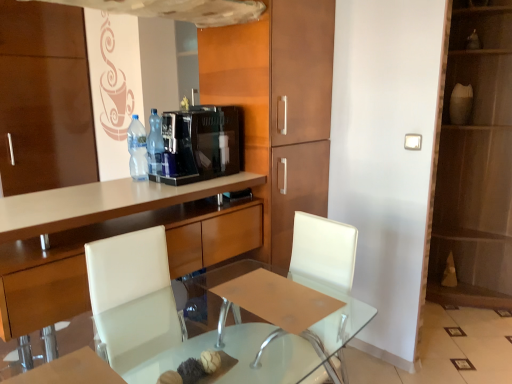
The height and width of the screenshot is (384, 512). What do you see at coordinates (111, 236) in the screenshot? I see `wooden cabinet at center, which appears as the second cabinetry when viewed from the right` at bounding box center [111, 236].

The image size is (512, 384). I want to click on translucent plastic bottle at center, which is the first bottle from right to left, so click(x=155, y=146).

Find the location of a particular element. The width and height of the screenshot is (512, 384). black glossy coffee machine at center is located at coordinates (200, 144).

Measure the distance between point (170, 338) and camera.

Point (170, 338) and camera are 5.65 feet apart from each other.

Identify the location of wooden cabinet at center, which ranks as the 1th cabinetry in right-to-left order. This screenshot has height=384, width=512. (278, 106).

Which object is positioned more to the right, matte brown dresser at right or white leather armchair at center?

matte brown dresser at right is more to the right.

Based on the photo, from the image's perspective, does matte brown dresser at right appear higher than white leather armchair at center?

Yes.

Could you tell me if matte brown dresser at right is turned towards white leather armchair at center?

No, matte brown dresser at right does not turn towards white leather armchair at center.

Based on the photo, is white leather armchair at center next to wooden cabinet at center, the 2th cabinetry when ordered from left to right, and touching it?

white leather armchair at center and wooden cabinet at center, the 2th cabinetry when ordered from left to right, are not in contact.

Looking at this image, from the image's perspective, is white leather armchair at center positioned above or below wooden cabinet at center, the 2th cabinetry when ordered from left to right?

From the image's perspective, white leather armchair at center appears below wooden cabinet at center, the 2th cabinetry when ordered from left to right.

The width and height of the screenshot is (512, 384). Find the location of `armchair located underneath the wooden cabinet at center, the 2th cabinetry when ordered from left to right (from a real-world perspective)`. armchair located underneath the wooden cabinet at center, the 2th cabinetry when ordered from left to right (from a real-world perspective) is located at coordinates (133, 297).

Is white leather armchair at center aimed at wooden cabinet at center, which ranks as the 1th cabinetry in right-to-left order?

No, white leather armchair at center is not oriented towards wooden cabinet at center, which ranks as the 1th cabinetry in right-to-left order.

How many degrees apart are the facing directions of wooden cabinet at center, which appears as the second cabinetry when viewed from the right, and matte brown dresser at right?

1.39 degrees.

From the image's perspective, is wooden cabinet at center, which appears as the second cabinetry when viewed from the right, positioned above or below matte brown dresser at right?

Clearly, from the image's perspective, wooden cabinet at center, which appears as the second cabinetry when viewed from the right, is below matte brown dresser at right.

Does wooden cabinet at center, marked as the 1th cabinetry in a left-to-right arrangement, appear on the right side of matte brown dresser at right?

No.

Is clear plastic bottle at center, which is the second bottle from right to left, in front of wooden cabinet at center, the 2th cabinetry when ordered from left to right?

No, clear plastic bottle at center, which is the second bottle from right to left, is further to the viewer.

Looking at this image, who is shorter, clear plastic bottle at center, which is the second bottle from right to left, or wooden cabinet at center, the 2th cabinetry when ordered from left to right?

clear plastic bottle at center, which is the second bottle from right to left, is shorter.

In the scene shown: Would you say clear plastic bottle at center, the 1th bottle in the left-to-right sequence, is to the left or to the right of wooden cabinet at center, which ranks as the 1th cabinetry in right-to-left order, in the picture?

clear plastic bottle at center, the 1th bottle in the left-to-right sequence, is positioned on wooden cabinet at center, which ranks as the 1th cabinetry in right-to-left order,'s left side.

What are the coordinates of `cabinetry located above the clear plastic bottle at center, the 1th bottle in the left-to-right sequence (from the image's perspective)` in the screenshot? It's located at (278, 106).

Is point (266, 381) positioned behind point (142, 173)?

No.

From the image's perspective, is transparent glass table at center located above or below clear plastic bottle at center, the 1th bottle in the left-to-right sequence?

transparent glass table at center is below clear plastic bottle at center, the 1th bottle in the left-to-right sequence.

In the scene shown: From the image's perspective, between wooden cabinet at center, the 2th cabinetry when ordered from left to right, and matte brown dresser at right, which one is located above?

matte brown dresser at right appears higher in the image.

In the scene shown: From a real-world perspective, is wooden cabinet at center, the 2th cabinetry when ordered from left to right, above or below matte brown dresser at right?

wooden cabinet at center, the 2th cabinetry when ordered from left to right, is situated higher than matte brown dresser at right in the real world.

Who is taller, wooden cabinet at center, which ranks as the 1th cabinetry in right-to-left order, or matte brown dresser at right?

Standing taller between the two is matte brown dresser at right.

Locate an element on the screen. This screenshot has width=512, height=384. dresser on the right side of wooden cabinet at center, the 2th cabinetry when ordered from left to right is located at coordinates (476, 164).

From the image's perspective, is matte brown dresser at right above or below translucent plastic bottle at center, which is the first bottle from right to left?

Clearly, from the image's perspective, matte brown dresser at right is above translucent plastic bottle at center, which is the first bottle from right to left.

Is matte brown dresser at right oriented towards translucent plastic bottle at center, which is the first bottle from right to left?

No, matte brown dresser at right is not oriented towards translucent plastic bottle at center, which is the first bottle from right to left.

Relative to translucent plastic bottle at center, positioned as the 2th bottle in left-to-right order, is matte brown dresser at right in front or behind?

matte brown dresser at right is behind translucent plastic bottle at center, positioned as the 2th bottle in left-to-right order.

Is point (507, 38) closer to viewer compared to point (150, 169)?

No.

Find the location of `armchair below the matte brown dresser at right (from a real-world perspective)`. armchair below the matte brown dresser at right (from a real-world perspective) is located at coordinates (133, 297).

Which cabinetry is the 2nd one when counting from the back of the white leather armchair at center? Please provide its 2D coordinates.

[(278, 106)]

Looking at the image, which one is located further to wooden cabinet at center, which appears as the second cabinetry when viewed from the right, wooden cabinet at center, the 2th cabinetry when ordered from left to right, or clear plastic bottle at center, which is the second bottle from right to left?

Among the two, wooden cabinet at center, the 2th cabinetry when ordered from left to right, is located further to wooden cabinet at center, which appears as the second cabinetry when viewed from the right.

Which object lies nearer to the anchor point wooden cabinet at center, marked as the 1th cabinetry in a left-to-right arrangement, black glossy coffee machine at center or transparent glass table at center?

black glossy coffee machine at center.

From the picture: Which object lies further to the anchor point transparent glass table at center, clear plastic bottle at center, which is the second bottle from right to left, or translucent plastic bottle at center, positioned as the 2th bottle in left-to-right order?

clear plastic bottle at center, which is the second bottle from right to left, lies further to transparent glass table at center than the other object.

Based on their spatial positions, is clear glass table at center or wooden cabinet at center, which appears as the second cabinetry when viewed from the right, further from black glossy coffee machine at center?

Based on the image, clear glass table at center appears to be further to black glossy coffee machine at center.

Which object lies nearer to the anchor point matte brown dresser at right, transparent glass table at center or wooden cabinet at center, marked as the 1th cabinetry in a left-to-right arrangement?

transparent glass table at center lies closer to matte brown dresser at right than the other object.

From the image, which object appears to be farther from clear glass table at center, wooden cabinet at center, which appears as the second cabinetry when viewed from the right, or matte brown dresser at right?

The object further to clear glass table at center is matte brown dresser at right.

Based on the photo, which object lies nearer to the anchor point white leather armchair at center, translucent plastic bottle at center, which is the first bottle from right to left, or wooden cabinet at center, marked as the 1th cabinetry in a left-to-right arrangement?

Among the two, wooden cabinet at center, marked as the 1th cabinetry in a left-to-right arrangement, is located nearer to white leather armchair at center.

Looking at the image, which one is located closer to transparent glass table at center, white leather armchair at center or translucent plastic bottle at center, positioned as the 2th bottle in left-to-right order?

white leather armchair at center lies closer to transparent glass table at center than the other object.

Where is `round table situated between wooden cabinet at center, marked as the 1th cabinetry in a left-to-right arrangement, and matte brown dresser at right from left to right`? The height and width of the screenshot is (384, 512). round table situated between wooden cabinet at center, marked as the 1th cabinetry in a left-to-right arrangement, and matte brown dresser at right from left to right is located at coordinates (287, 334).

You are a GUI agent. You are given a task and a screenshot of the screen. Output one action in this format:
    pyautogui.click(x=<x>, y=<y>)
    Task: Click on the coffee machine between white leather armchair at center and matte brown dresser at right from left to right
    
    Given the screenshot: What is the action you would take?
    pyautogui.click(x=200, y=144)

Where is `bottle between black glossy coffee machine at center and wooden cabinet at center, marked as the 1th cabinetry in a left-to-right arrangement, in the vertical direction`? The height and width of the screenshot is (384, 512). bottle between black glossy coffee machine at center and wooden cabinet at center, marked as the 1th cabinetry in a left-to-right arrangement, in the vertical direction is located at coordinates (137, 150).

Locate an element on the screen. coffee machine located between transparent glass table at center and translucent plastic bottle at center, which is the first bottle from right to left, in the depth direction is located at coordinates (200, 144).